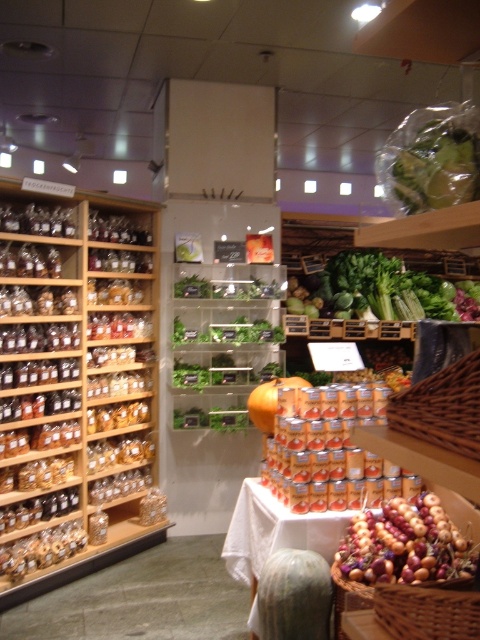
What do you see at coordinates (386, 289) in the screenshot? I see `green leafy at center` at bounding box center [386, 289].

Is point (444, 298) in front of point (457, 595)?

That is False.

Is point (400, 308) farther from camera compared to point (406, 588)?

Yes, it is.

You are a GUI agent. You are given a task and a screenshot of the screen. Output one action in this format:
    pyautogui.click(x=<x>, y=<y>)
    Task: Click on the green leafy at center
    The width and height of the screenshot is (480, 640).
    Given the screenshot: What is the action you would take?
    pyautogui.click(x=386, y=289)

Between translucent glass jars at left and green leafy at center, which one is positioned higher?

green leafy at center is above.

Can you confirm if translucent glass jars at left is wider than green leafy at center?

No, translucent glass jars at left is not wider than green leafy at center.

Locate an element on the screen. The height and width of the screenshot is (640, 480). translucent glass jars at left is located at coordinates (76, 390).

Can you confirm if smooth brown onions at center is positioned above woven brown basket at center-right?

Incorrect, smooth brown onions at center is not positioned above woven brown basket at center-right.

Does smooth brown onions at center appear under woven brown basket at center-right?

Yes, smooth brown onions at center is below woven brown basket at center-right.

The height and width of the screenshot is (640, 480). Find the location of `smooth brown onions at center`. smooth brown onions at center is located at coordinates (405, 545).